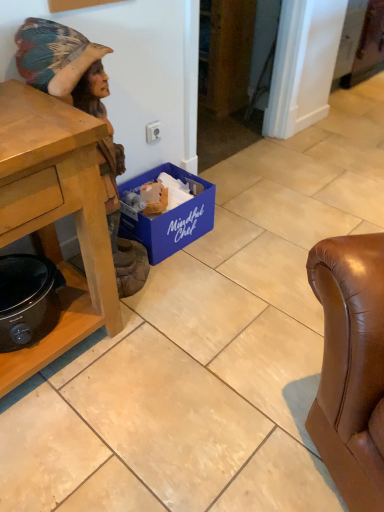
Locate an element on the screen. This screenshot has height=512, width=384. vacant area that lies between wooden statue at left and blue cardboard box at lower center is located at coordinates (188, 253).